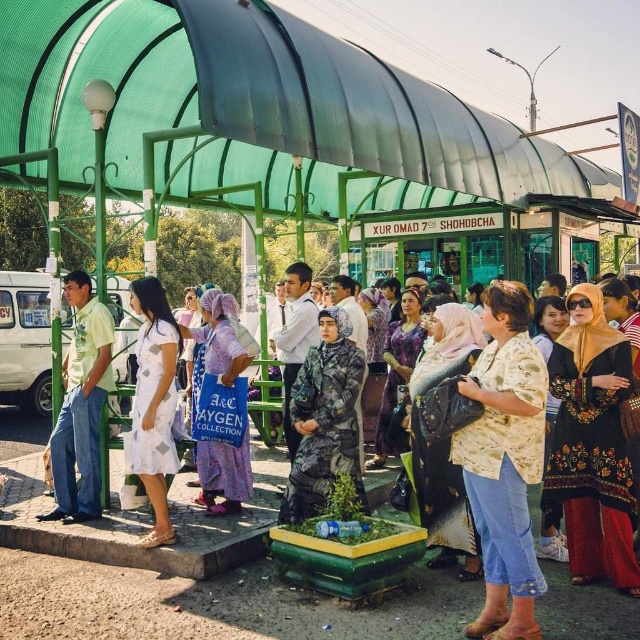
Which of these two, light beige printed blouse at center or camouflage uniform at center, stands shorter?

Standing shorter between the two is camouflage uniform at center.

Describe the element at coordinates (504, 461) in the screenshot. I see `light beige printed blouse at center` at that location.

You are a GUI agent. You are given a task and a screenshot of the screen. Output one action in this format:
    pyautogui.click(x=<x>, y=<y>)
    Task: Click on the light beige printed blouse at center
    The width and height of the screenshot is (640, 640).
    Given the screenshot: What is the action you would take?
    pyautogui.click(x=504, y=461)

You are a GUI agent. You are given a task and a screenshot of the screen. Output one action in this format:
    pyautogui.click(x=<x>, y=<y>)
    Task: Click on the light green shirt at center
    
    Given the screenshot: What is the action you would take?
    pyautogui.click(x=81, y=404)

In the scene shown: Who is positioned more to the left, light green shirt at center or camouflage uniform at center?

From the viewer's perspective, light green shirt at center appears more on the left side.

Is point (80, 493) behind point (310, 300)?

No, (80, 493) is closer to viewer.

You are a GUI agent. You are given a task and a screenshot of the screen. Output one action in this format:
    pyautogui.click(x=<x>, y=<y>)
    Task: Click on the light green shirt at center
    
    Given the screenshot: What is the action you would take?
    pyautogui.click(x=81, y=404)

Does white printed dress at center lie behind camouflage uniform at center?

That is False.

Is white printed dress at center wider than camouflage uniform at center?

No, white printed dress at center is not wider than camouflage uniform at center.

Where is `white printed dress at center`? white printed dress at center is located at coordinates (154, 403).